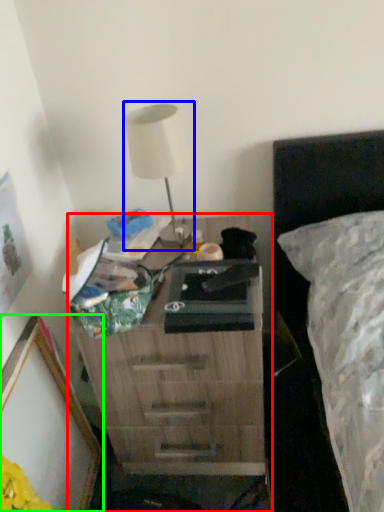
Question: Based on their relative distances, which object is farther from nightstand (highlighted by a red box)? Choose from table lamp (highlighted by a blue box) and picture frame (highlighted by a green box).

Choices:
 (A) table lamp
 (B) picture frame

Answer: (A)